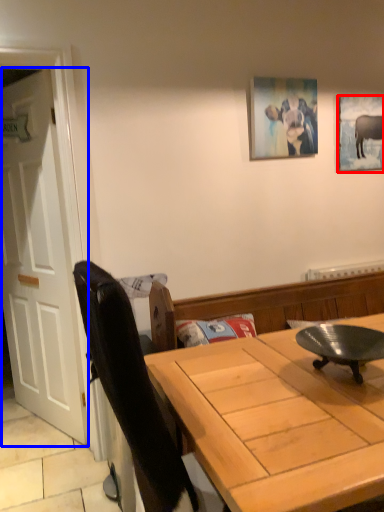
Question: Among these objects, which one is farthest to the camera, picture frame (highlighted by a red box) or door (highlighted by a blue box)?

Choices:
 (A) picture frame
 (B) door

Answer: (A)